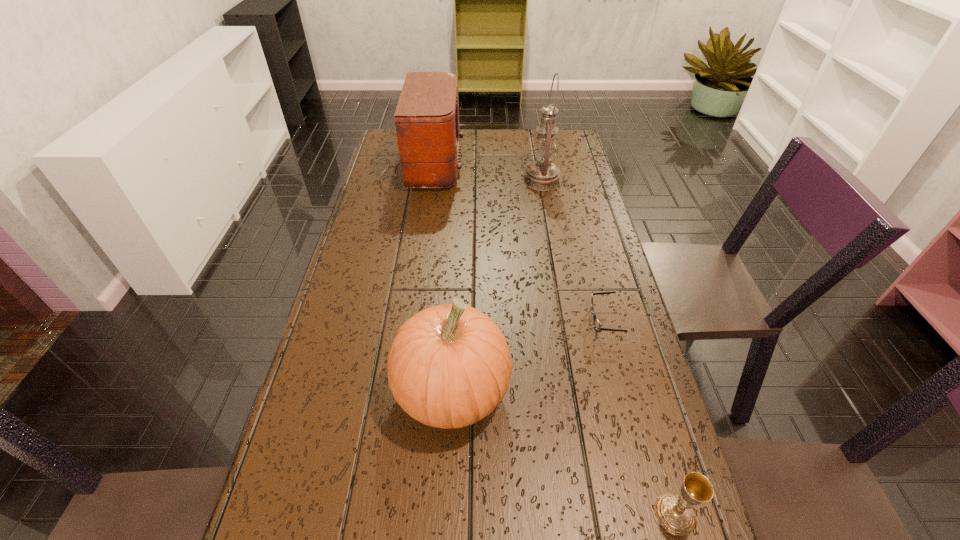
This screenshot has height=540, width=960. I want to click on free space located on the left of the nearest object, so click(558, 514).

Locate an element on the screen. vacant space located 0.300m on the front-facing side of the shortest object is located at coordinates (468, 320).

What are the coordinates of `free space located 0.290m on the front-facing side of the shortest object` in the screenshot? It's located at (472, 320).

In order to click on vacant space located 0.320m on the front-facing side of the shortest object in this screenshot , I will do `click(460, 320)`.

Identify the location of object situated at the far edge. The image size is (960, 540). (426, 119).

Find the location of a particular element. The width and height of the screenshot is (960, 540). object situated at the left edge is located at coordinates (426, 119).

The height and width of the screenshot is (540, 960). Identify the location of oil lamp that is at the right edge. (542, 175).

At what (x,y) coordinates should I click in order to perform the action: click on chalice that is at the right edge. Please return your answer as a coordinate pair (x, y). This screenshot has height=540, width=960. Looking at the image, I should click on (675, 514).

The width and height of the screenshot is (960, 540). Find the location of `spectacles present at the right edge`. spectacles present at the right edge is located at coordinates (597, 325).

I want to click on object at the far left corner, so coord(426,119).